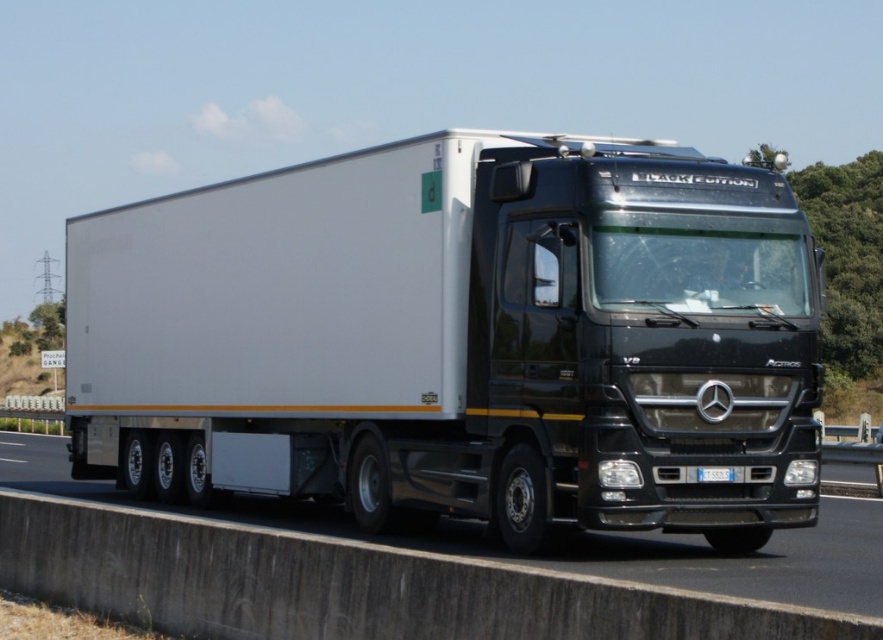
Question: Considering the real-world distances, which object is farthest from the white glossy trailer at center?

Choices:
 (A) black glossy truck at center
 (B) white plastic license plate at center

Answer: (B)

Question: Does white glossy trailer at center appear under black glossy truck at center?

Choices:
 (A) no
 (B) yes

Answer: (A)

Question: In this image, where is black glossy truck at center located relative to white plastic license plate at center?

Choices:
 (A) below
 (B) above

Answer: (A)

Question: Which object is the closest to the white plastic license plate at center?

Choices:
 (A) white glossy trailer at center
 (B) black glossy truck at center

Answer: (A)

Question: Does white glossy trailer at center appear on the right side of black glossy truck at center?

Choices:
 (A) no
 (B) yes

Answer: (B)

Question: Which point is closer to the camera?

Choices:
 (A) white plastic license plate at center
 (B) white glossy trailer at center

Answer: (B)